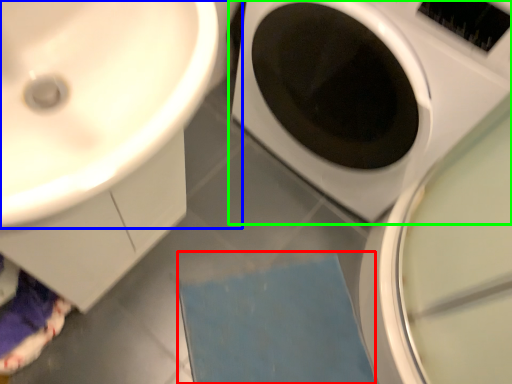
Question: Which is nearer to the bath mat (highlighted by a red box)? sink (highlighted by a blue box) or washing machine (highlighted by a green box).

Choices:
 (A) sink
 (B) washing machine

Answer: (B)